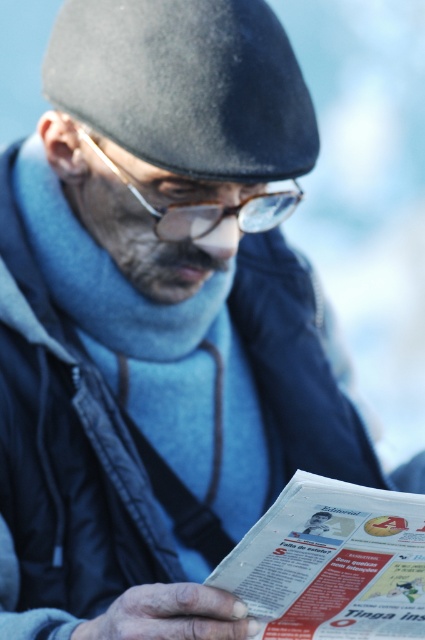
You are a photographer trying to capture a clear shot of the printed paper at lower center without the dark gray felt beret at upper center blocking it. What adjustment should you make to your camera position?

Move your camera position backward so that the printed paper at lower center becomes closer to the camera than the dark gray felt beret at upper center.

You are a photographer trying to capture the scene as described. If you want to focus on the printed paper at lower center without the dark gray felt beret at upper center overlapping it, should you adjust your camera angle upwards or downwards?

The dark gray felt beret at upper center is located above the printed paper at lower center. To avoid overlapping, you should adjust your camera angle downwards to focus on the printed paper at lower center while moving the view below the beret.

You are a photographer adjusting your camera settings to capture the dark gray felt beret at upper center. The camera has a focus point grid with coordinates from 0 to 1 on both axes. Where should you place the focus point to ensure the beret is sharp?

You should place the focus point at coordinates 0.133 on the x axis and 0.438 on the y axis to ensure the dark gray felt beret at upper center is sharp.